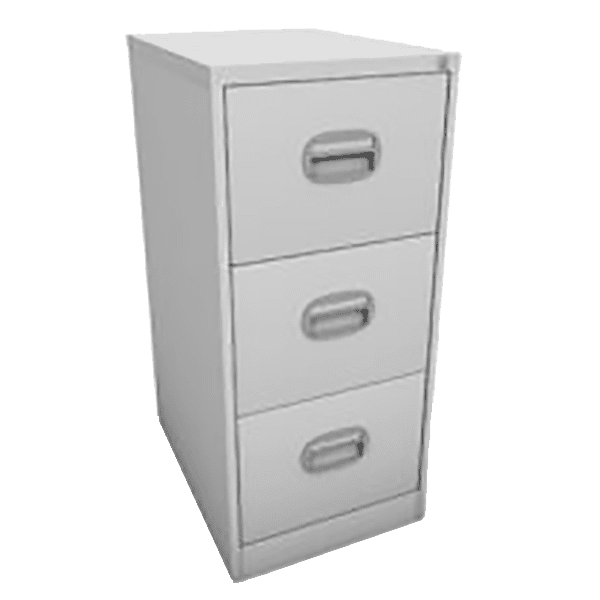
Find the location of `top of cabinet`. top of cabinet is located at coordinates (293, 548), (253, 41).